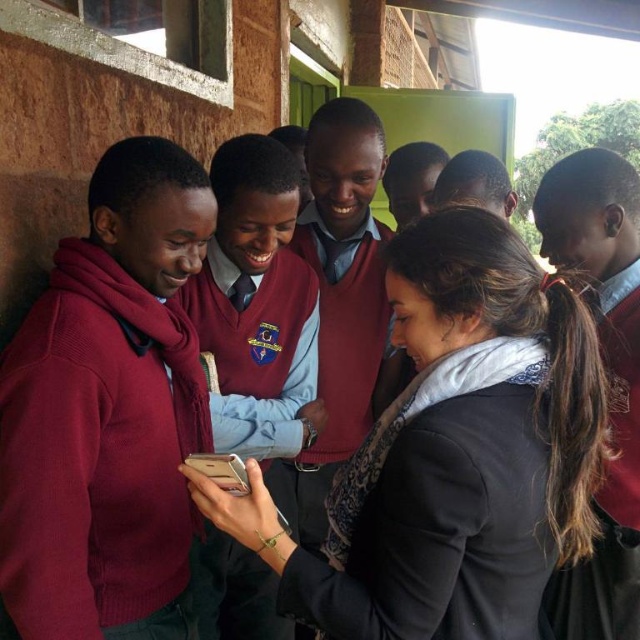
Is point (364, 518) positioned behind point (248, 291)?

No, (364, 518) is closer to viewer.

What do you see at coordinates (438, 509) in the screenshot?
I see `black matte sweater at center` at bounding box center [438, 509].

Locate an element on the screen. The height and width of the screenshot is (640, 640). black matte sweater at center is located at coordinates (438, 509).

Between point (163, 513) and point (369, 579), which one is positioned in front?

Point (369, 579) is more forward.

Measure the distance between maroon sweater at left and camera.

maroon sweater at left is 3.44 feet from camera.

Locate an element on the screen. Image resolution: width=640 pixels, height=640 pixels. maroon sweater at left is located at coordinates (97, 451).

Locate an element on the screen. black matte jacket at center is located at coordinates (452, 456).

Is point (372, 572) positioned behind point (520, 528)?

Yes, point (372, 572) is behind point (520, 528).

This screenshot has height=640, width=640. Identify the location of black matte jacket at center. (452, 456).